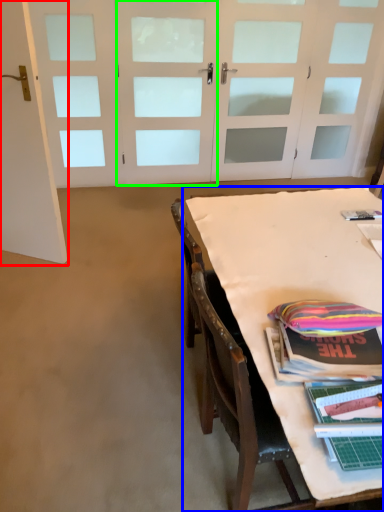
Question: Which object is the closest to the door (highlighted by a red box)? Choose among these: table (highlighted by a blue box) or door (highlighted by a green box).

Choices:
 (A) table
 (B) door

Answer: (A)